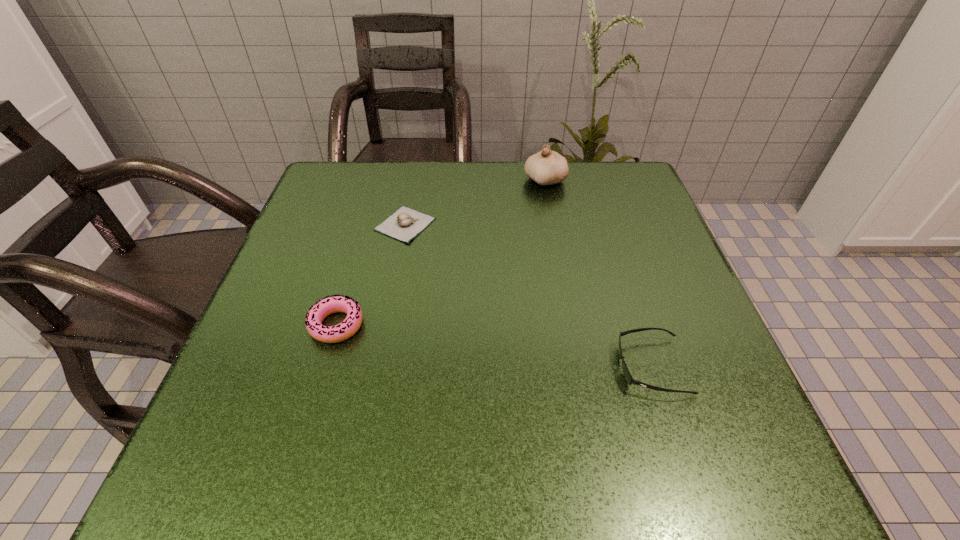
The height and width of the screenshot is (540, 960). Find the location of `the second object from right to left`. the second object from right to left is located at coordinates (546, 167).

At what (x,y) coordinates should I click in order to perform the action: click on the taller garlic. Please return your answer as a coordinate pair (x, y). Looking at the image, I should click on (546, 167).

Identify the location of doughnut. This screenshot has width=960, height=540. (317, 313).

In order to click on sunglasses in this screenshot , I will do `click(627, 375)`.

Where is `the shorter garlic`? The height and width of the screenshot is (540, 960). the shorter garlic is located at coordinates coord(404,224).

The width and height of the screenshot is (960, 540). What are the coordinates of `the third nearest object` in the screenshot? It's located at (x=404, y=224).

Where is `free spot located 0.130m on the left of the farther garlic`? This screenshot has height=540, width=960. free spot located 0.130m on the left of the farther garlic is located at coordinates (472, 181).

At what (x,y) coordinates should I click in order to perform the action: click on free space located 0.360m on the back of the doughnut. Please return your answer as a coordinate pair (x, y). Image resolution: width=960 pixels, height=540 pixels. Looking at the image, I should click on (375, 194).

Find the location of `vacant region located 0.240m on the front-facing side of the rightmost object`. vacant region located 0.240m on the front-facing side of the rightmost object is located at coordinates (471, 366).

Where is `free space located on the front-facing side of the rightmost object`? The height and width of the screenshot is (540, 960). free space located on the front-facing side of the rightmost object is located at coordinates (502, 366).